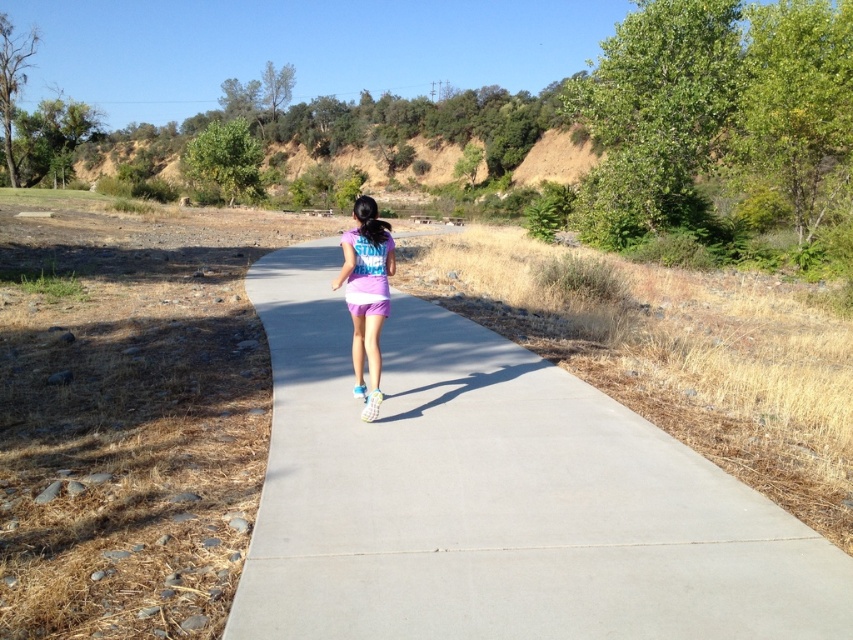
Is gray concrete pavement at center bigger than purple fabric shorts at center?

Yes, gray concrete pavement at center is bigger than purple fabric shorts at center.

Does point (641, 513) come in front of point (358, 221)?

Yes, it is.

You are a GUI agent. You are given a task and a screenshot of the screen. Output one action in this format:
    pyautogui.click(x=<x>, y=<y>)
    Task: Click on the gray concrete pavement at center
    The height and width of the screenshot is (640, 853).
    Given the screenshot: What is the action you would take?
    pyautogui.click(x=496, y=497)